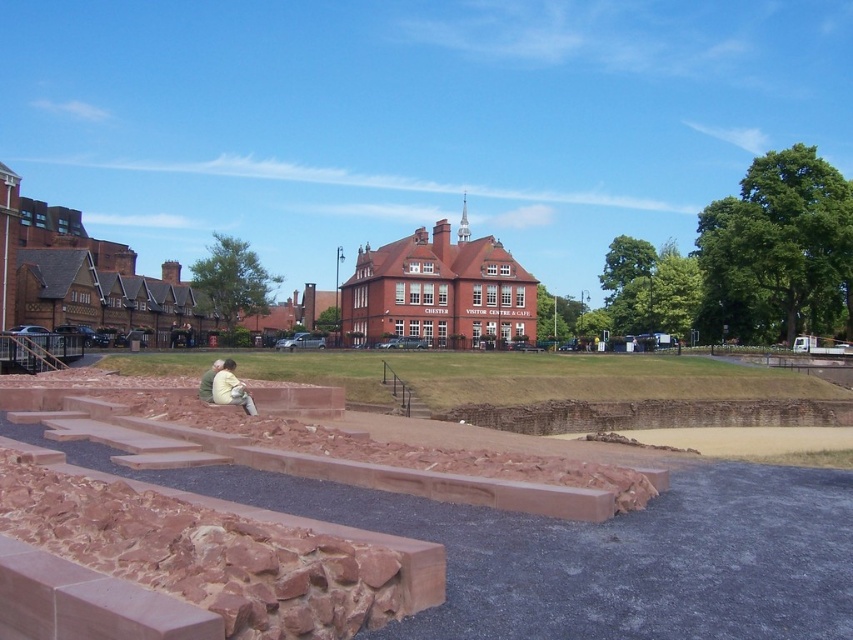
You are planning to have a picnic at the historical site. You have a picnic blanket made of light beige fabric at center. Where should you place it to ensure it stays in place and doesn not blow away? Use the brown stone park at center in your answer.

The light beige fabric at center should be placed on top of the brown stone park at center since the brown stone park at center is positioned under it, providing a stable surface to anchor the fabric and prevent it from moving.

You are standing at the entrance of the historical site and notice two fabrics in the scene. The light beige fabric at center and the green fabric jacket at lower left. Which fabric is closer to you?

The light beige fabric at center is closer to you because it is in front of the green fabric jacket at lower left.